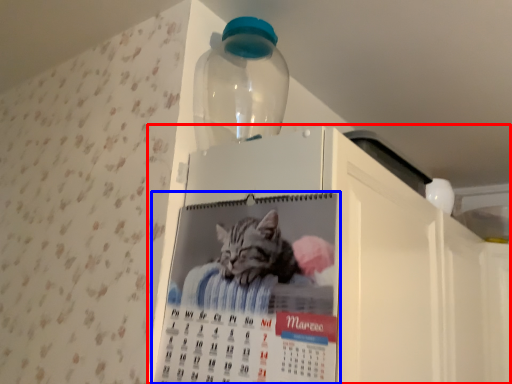
Question: Which object appears closest to the camera in this image, appliance (highlighted by a red box) or poster (highlighted by a blue box)?

Choices:
 (A) appliance
 (B) poster

Answer: (A)